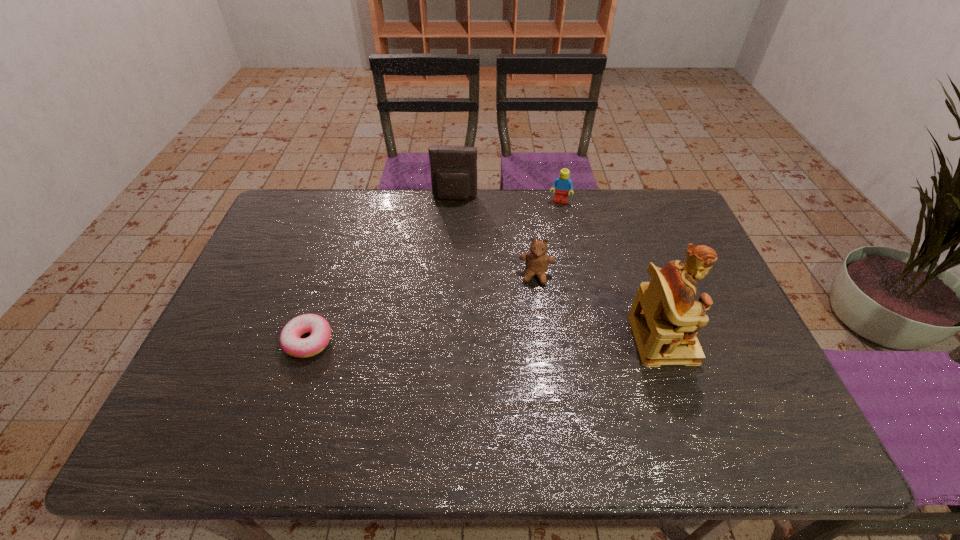
Where is `free space on the desktop that is between the leftmost object and the rightmost object and is positioned on the face of the teddy bear`? The height and width of the screenshot is (540, 960). free space on the desktop that is between the leftmost object and the rightmost object and is positioned on the face of the teddy bear is located at coordinates (529, 340).

Where is `free spot on the desktop that is between the leftmost object and the figurine and is positioned with an open flap on the pouch`? This screenshot has width=960, height=540. free spot on the desktop that is between the leftmost object and the figurine and is positioned with an open flap on the pouch is located at coordinates (435, 340).

Locate an element on the screen. The height and width of the screenshot is (540, 960). vacant space on the desktop that is between the doughnut and the rightmost object and is positioned on the face of the Lego is located at coordinates (532, 340).